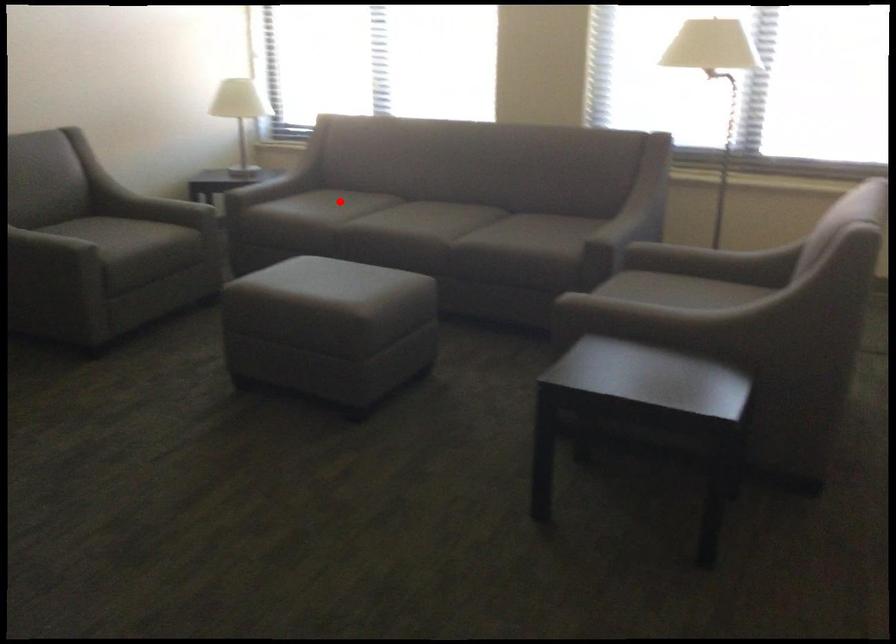
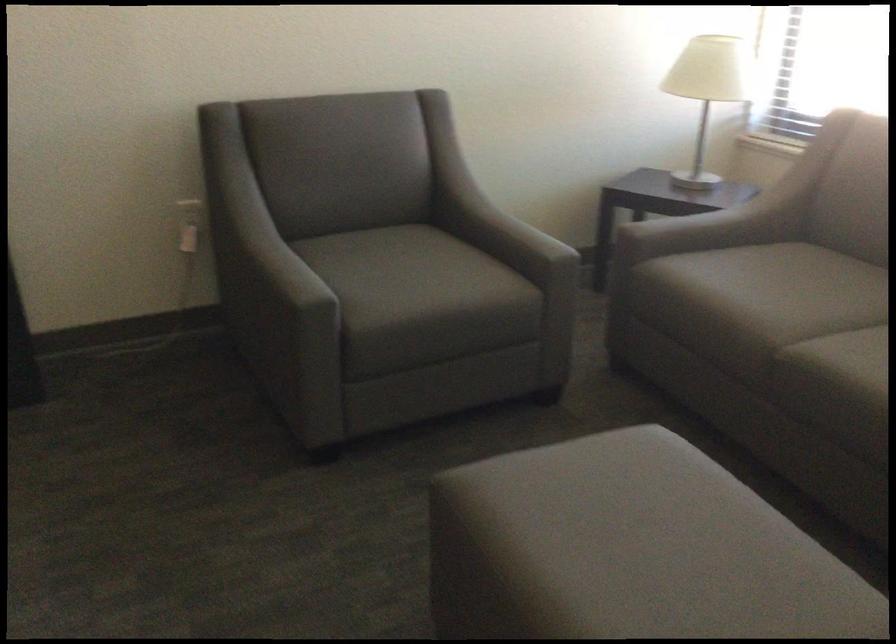
Question: A red point is marked in image1. In image2, is the corresponding 3D point closer to the camera or farther? Reply with the corresponding letter.

Choices:
 (A) The corresponding 3D point is closer.
 (B) The corresponding 3D point is farther.

Answer: (A)